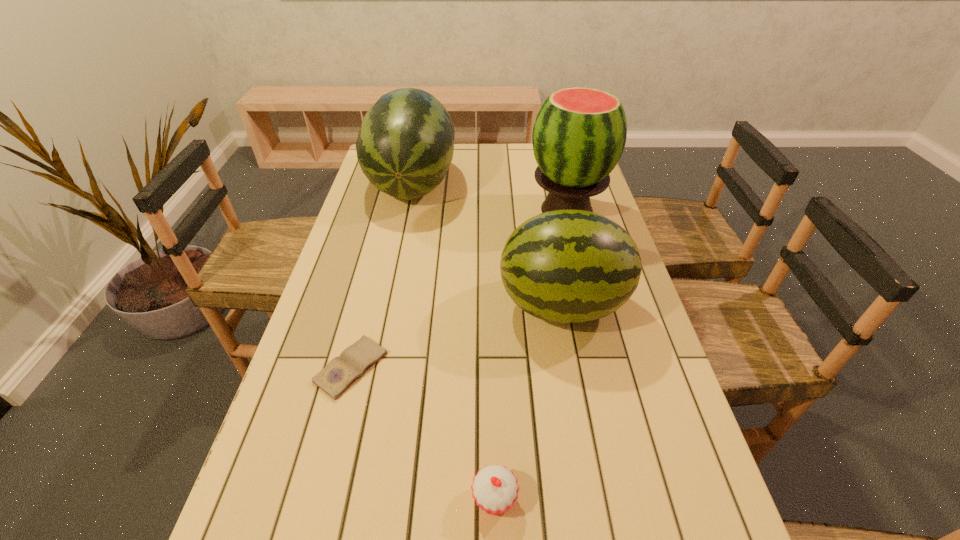
Identify the location of vacant area situated 0.180m at the stem end of the shortest watermelon. (427, 305).

I want to click on free space located on the back of the cupcake, so click(492, 415).

I want to click on vacant space located on the back of the shortest object, so click(x=371, y=293).

At what (x,y) coordinates should I click in order to perform the action: click on object present at the far edge. Please return your answer as a coordinate pair (x, y). The image size is (960, 540). Looking at the image, I should click on (405, 145).

I want to click on watermelon present at the left edge, so click(x=405, y=145).

This screenshot has width=960, height=540. Find the location of `diary that is at the left edge`. diary that is at the left edge is located at coordinates (341, 372).

Where is `object located in the far left corner section of the desktop`? object located in the far left corner section of the desktop is located at coordinates (405, 145).

Find the location of a particular element. free region at the far edge of the desktop is located at coordinates (508, 168).

Locate an element on the screen. Image resolution: width=960 pixels, height=540 pixels. vacant position at the left edge of the desktop is located at coordinates (270, 534).

The height and width of the screenshot is (540, 960). I want to click on vacant region between the diary and the cupcake, so click(422, 433).